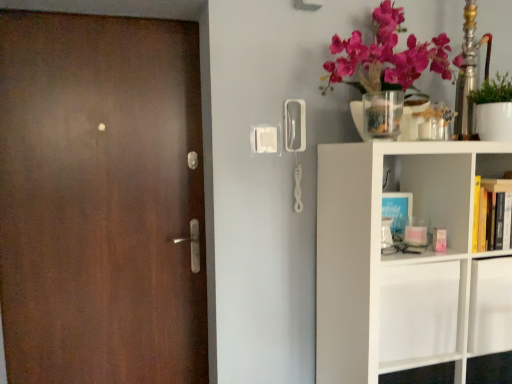
Question: Can you confirm if white matte shelf at right is thinner than matte brown door at left?

Choices:
 (A) no
 (B) yes

Answer: (A)

Question: Is white matte shelf at right beside matte brown door at left?

Choices:
 (A) yes
 (B) no

Answer: (B)

Question: From the image's perspective, is white matte shelf at right under matte brown door at left?

Choices:
 (A) yes
 (B) no

Answer: (A)

Question: Is white matte shelf at right positioned in front of matte brown door at left?

Choices:
 (A) no
 (B) yes

Answer: (B)

Question: Does white matte shelf at right appear on the right side of matte brown door at left?

Choices:
 (A) yes
 (B) no

Answer: (A)

Question: From the image's perspective, is clear glass vase at upper right located above or below matte brown door at left?

Choices:
 (A) above
 (B) below

Answer: (A)

Question: In terms of size, does clear glass vase at upper right appear bigger or smaller than matte brown door at left?

Choices:
 (A) big
 (B) small

Answer: (B)

Question: From their relative heights in the image, would you say clear glass vase at upper right is taller or shorter than matte brown door at left?

Choices:
 (A) tall
 (B) short

Answer: (B)

Question: Considering the positions of clear glass vase at upper right and matte brown door at left in the image, is clear glass vase at upper right wider or thinner than matte brown door at left?

Choices:
 (A) thin
 (B) wide

Answer: (B)

Question: Considering the positions of green matte plant at upper right and clear glass vase at upper right in the image, is green matte plant at upper right taller or shorter than clear glass vase at upper right?

Choices:
 (A) short
 (B) tall

Answer: (B)

Question: From the image's perspective, relative to clear glass vase at upper right, is green matte plant at upper right above or below?

Choices:
 (A) above
 (B) below

Answer: (A)

Question: In terms of size, does green matte plant at upper right appear bigger or smaller than clear glass vase at upper right?

Choices:
 (A) big
 (B) small

Answer: (A)

Question: From a real-world perspective, relative to clear glass vase at upper right, is green matte plant at upper right vertically above or below?

Choices:
 (A) above
 (B) below

Answer: (A)

Question: From a real-world perspective, is matte brown door at left physically located above or below green matte plant at upper right?

Choices:
 (A) below
 (B) above

Answer: (A)

Question: Is matte brown door at left wider or thinner than green matte plant at upper right?

Choices:
 (A) wide
 (B) thin

Answer: (B)